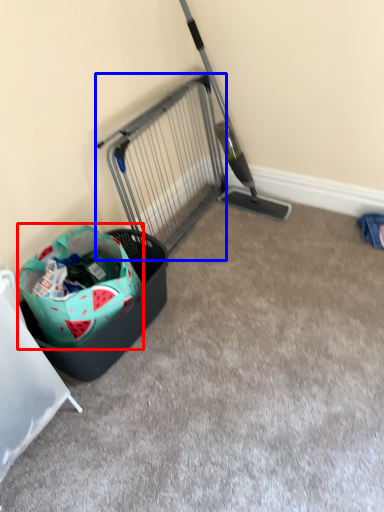
Question: Which object appears farthest to the camera in this image, shopping bag (highlighted by a red box) or cage (highlighted by a blue box)?

Choices:
 (A) shopping bag
 (B) cage

Answer: (B)